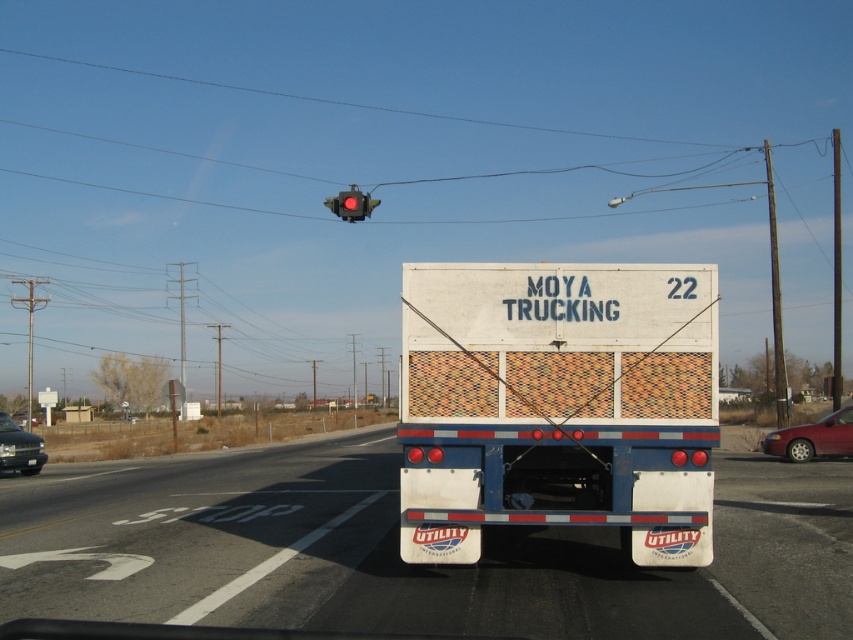
You are a delivery driver who needs to back up your white utility trailer at center into a loading dock that is 6 meters away. Can you safely back it into the dock without overstepping the stop line?

The white utility trailer at center is 5.97 meters away from camera, so yes, you can safely back it into the loading dock since the distance is just under 6 meters and you won

You are a pedestrian waiting at the intersection. You notice the metallic red sedan at right and the metallic gray sedan at lower left. Which car is narrower?

The metallic red sedan at right is narrower than the metallic gray sedan at lower left.

You are a delivery driver approaching the intersection and need to know if your vehicle can pass under a low bridge ahead. The bridge has a height restriction sign indicating a maximum clearance of 3 meters. You observe the white utility trailer at center and the metallic gray sedan at lower left in the scene. Which vehicle, if either, would likely require a lower clearance to pass safely?

The metallic gray sedan at lower left would likely require a lower clearance to pass safely because it is shorter than the white utility trailer at center, which is taller. Since the bridge has a 3 meter clearance, the sedan could pass under it more easily than the taller trailer.